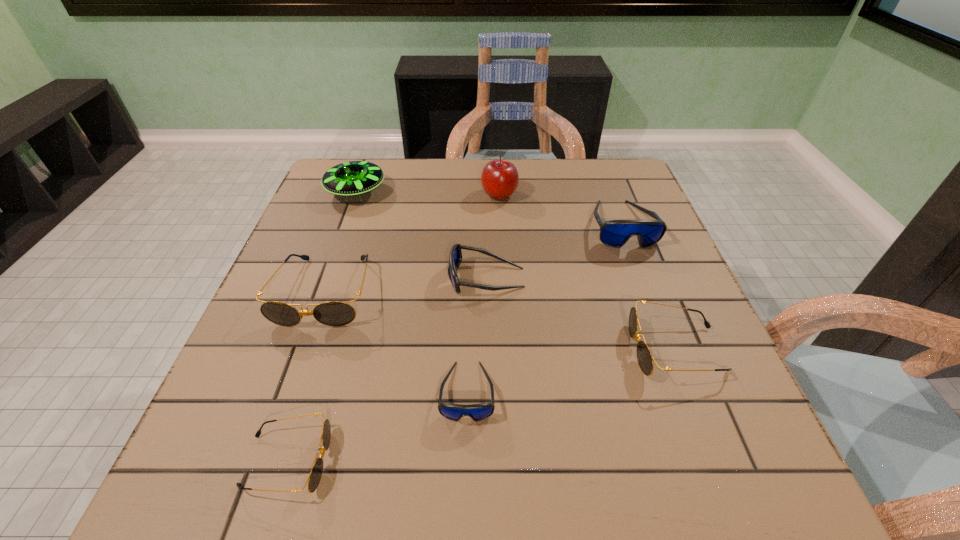
Find the location of a particular element. The image size is (960, 540). object located in the far right corner section of the desktop is located at coordinates (615, 233).

At what (x,y) coordinates should I click in order to perform the action: click on vacant position at the far edge of the desktop. Please return your answer as a coordinate pair (x, y). Looking at the image, I should click on (530, 183).

Find the location of `vacant space at the left edge`. vacant space at the left edge is located at coordinates (324, 233).

Find the location of `free space at the right edge of the desktop`. free space at the right edge of the desktop is located at coordinates (659, 288).

The width and height of the screenshot is (960, 540). In the image, there is a desktop. Find the location of `vacant space at the far left corner`. vacant space at the far left corner is located at coordinates (340, 197).

Image resolution: width=960 pixels, height=540 pixels. I want to click on free region at the near left corner, so click(185, 505).

Locate an element on the screen. free space at the near right corner of the desktop is located at coordinates (764, 461).

Locate an element on the screen. This screenshot has width=960, height=540. free spot between the apple and the second farthest blue sunglasses is located at coordinates (492, 236).

This screenshot has width=960, height=540. I want to click on free space between the second smallest blue sunglasses and the biggest black sunglasses, so click(x=405, y=285).

At what (x,y) coordinates should I click in order to perform the action: click on vacant point located between the rightmost blue sunglasses and the smallest black sunglasses. Please return your answer as a coordinate pair (x, y). Looking at the image, I should click on (454, 343).